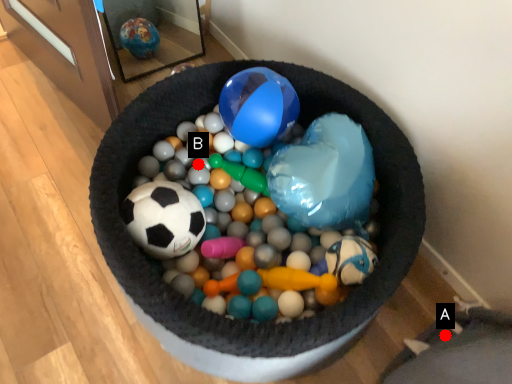
Question: Two points are circled on the image, labeled by A and B beside each circle. Among these points, which one is farthest from the camera?

Choices:
 (A) A is further
 (B) B is further

Answer: (B)